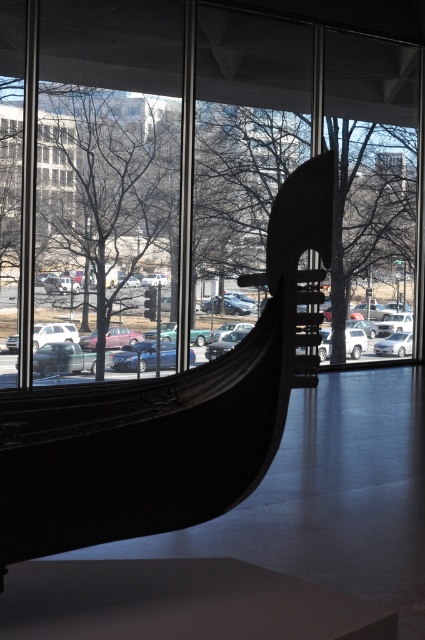
Question: Which point appears farthest from the camera in this image?

Choices:
 (A) (167, 340)
 (B) (377, 344)
 (C) (136, 28)
 (D) (14, 349)

Answer: (B)

Question: Which point appears closest to the camera in this image?

Choices:
 (A) (116, 333)
 (B) (411, 344)

Answer: (A)

Question: Is black polished wood boat at center positioned at the back of shiny blue sedan at center?

Choices:
 (A) no
 (B) yes

Answer: (A)

Question: Considering the real-world distances, which object is farthest from the white matte car at left?

Choices:
 (A) shiny blue sedan at center
 (B) black polished wood boat at center
 (C) white glossy car at center

Answer: (B)

Question: Is transparent glass window at center smaller than white glossy car at center?

Choices:
 (A) yes
 (B) no

Answer: (B)

Question: Is transparent glass window at center positioned in front of white glossy car at center?

Choices:
 (A) no
 (B) yes

Answer: (B)